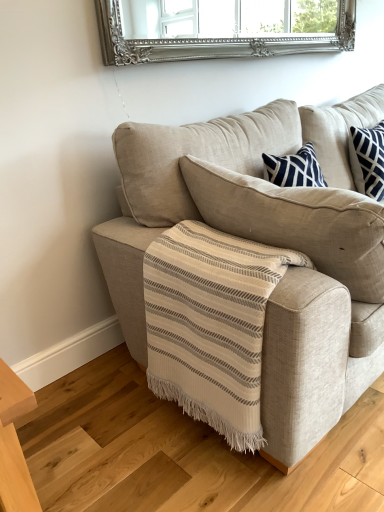
Question: In terms of size, does beige fabric couch at center appear bigger or smaller than wooden floor at lower left?

Choices:
 (A) big
 (B) small

Answer: (A)

Question: Based on their positions, is beige fabric couch at center located to the left or right of wooden floor at lower left?

Choices:
 (A) left
 (B) right

Answer: (B)

Question: From the image's perspective, relative to wooden floor at lower left, is beige fabric couch at center above or below?

Choices:
 (A) above
 (B) below

Answer: (A)

Question: From the image's perspective, is wooden floor at lower left located above or below beige fabric couch at center?

Choices:
 (A) above
 (B) below

Answer: (B)

Question: Is wooden floor at lower left wider or thinner than beige fabric couch at center?

Choices:
 (A) thin
 (B) wide

Answer: (B)

Question: Is point (162, 451) positioned closer to the camera than point (349, 346)?

Choices:
 (A) farther
 (B) closer

Answer: (A)

Question: Visually, is wooden floor at lower left positioned to the left or to the right of beige fabric couch at center?

Choices:
 (A) right
 (B) left

Answer: (B)